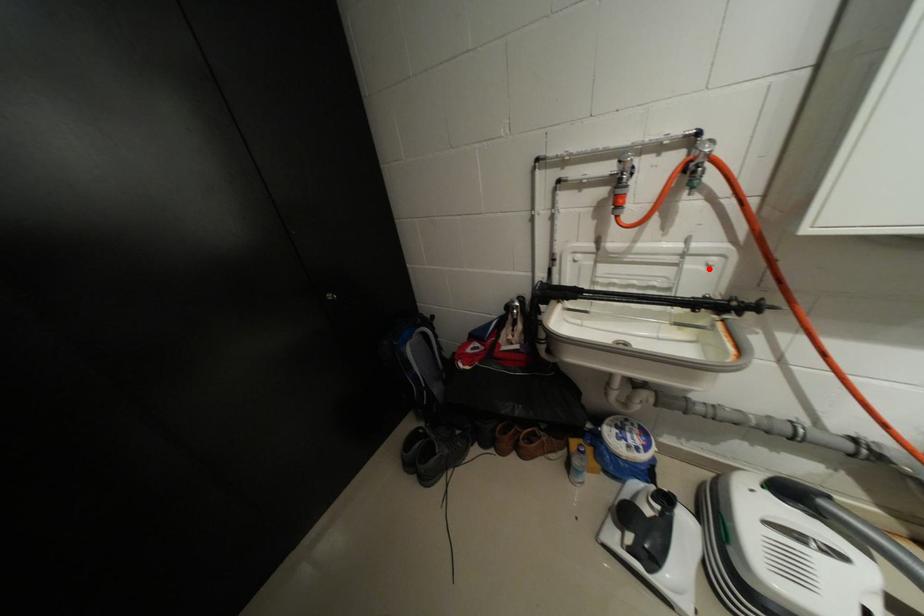
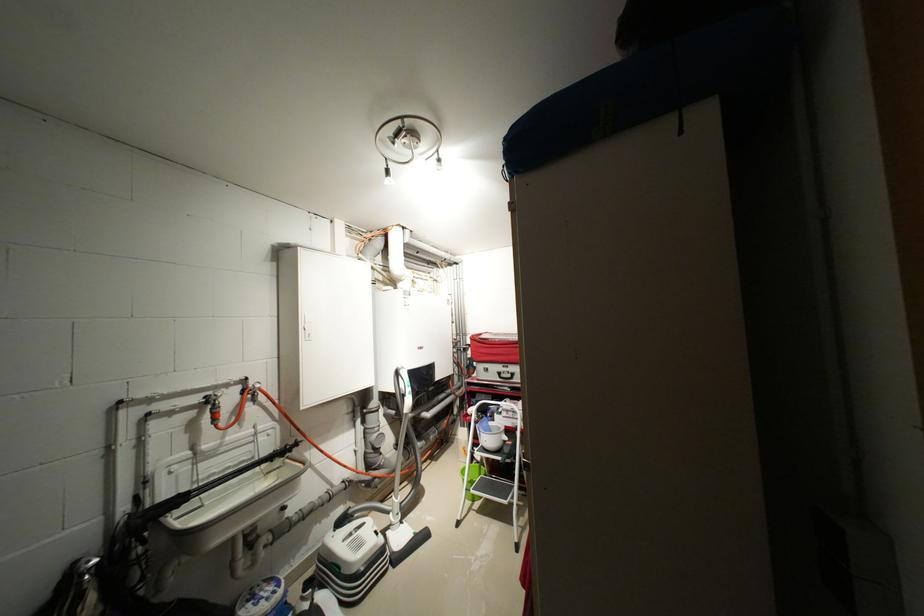
Locate, in the second image, the point that corresponds to the highlighted location in the first image.

(273, 439)